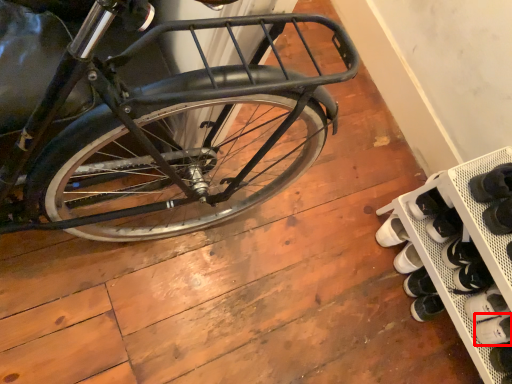
Question: From the image's perspective, considering the relative positions of shoe (annotated by the red box) and shelf in the image provided, where is shoe (annotated by the red box) located with respect to the staircase?

Choices:
 (A) above
 (B) below

Answer: (B)